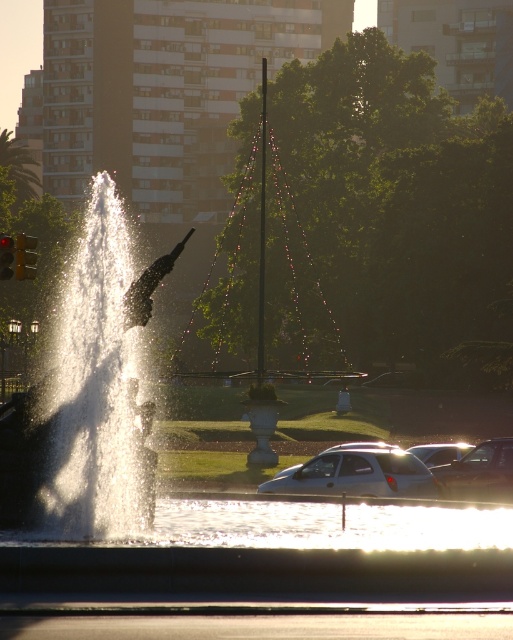
Who is positioned more to the right, metallic silver sedan at lower right or white glossy car at lower right?

From the viewer's perspective, white glossy car at lower right appears more on the right side.

Is metallic silver sedan at lower right positioned in front of white glossy car at lower right?

Yes.

Locate an element on the screen. Image resolution: width=513 pixels, height=640 pixels. metallic silver sedan at lower right is located at coordinates (479, 472).

Does point (427, 474) come behind point (464, 445)?

No, (427, 474) is closer to viewer.

Which is in front, point (305, 468) or point (448, 451)?

Point (305, 468) is more forward.

This screenshot has width=513, height=640. What are the coordinates of `white matte car at center` in the screenshot? It's located at (356, 474).

Is clear water at center positioned behind white matte car at center?

No, clear water at center is closer to the viewer.

Is point (112, 307) positioned before point (326, 477)?

Yes, it is.

Between point (63, 308) and point (332, 468), which one is positioned behind?

The point (63, 308) is more distant.

The width and height of the screenshot is (513, 640). In order to click on clear water at center in this screenshot , I will do `click(89, 396)`.